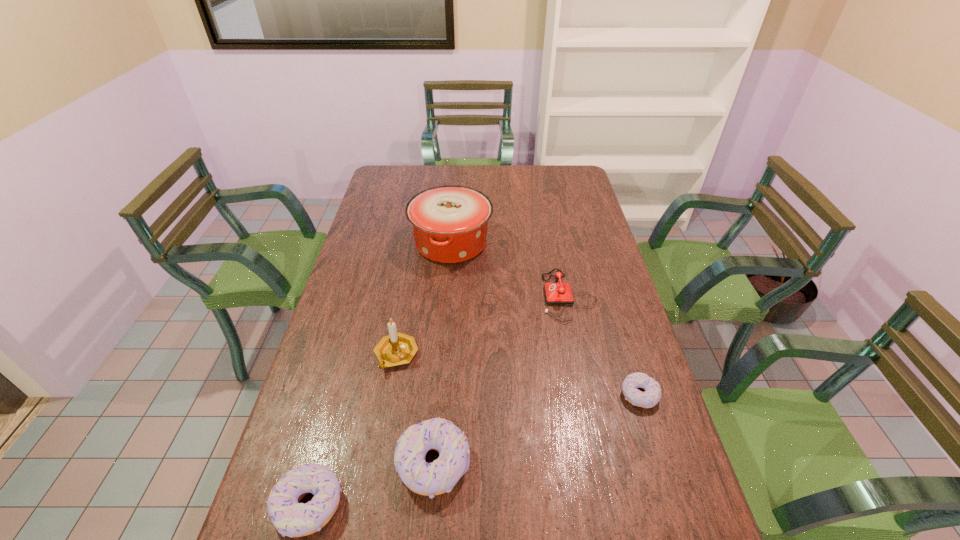
Locate an element on the screen. This screenshot has width=960, height=540. vacant spot for a new doughnut to ensure equal spacing is located at coordinates (543, 427).